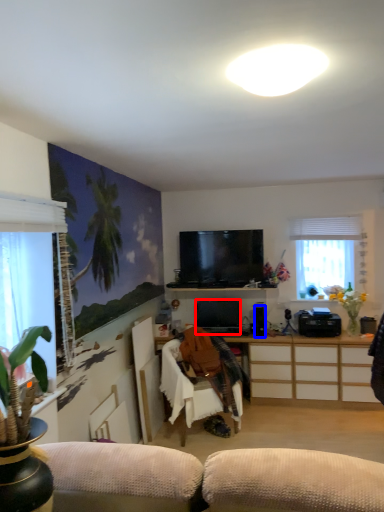
Question: Which object appears closest to the camera in this image, television (highlighted by a red box) or speaker (highlighted by a blue box)?

Choices:
 (A) television
 (B) speaker

Answer: (B)